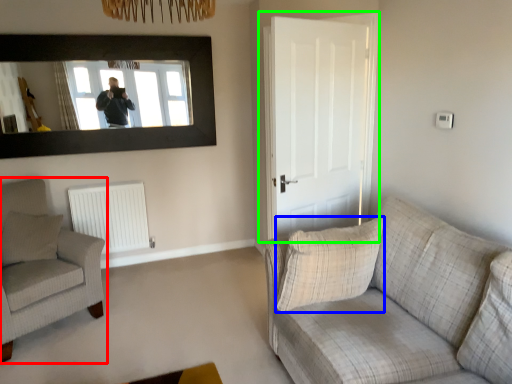
Question: Based on their relative distances, which object is farther from chair (highlighted by a red box)? Choose from pillow (highlighted by a blue box) and door (highlighted by a green box).

Choices:
 (A) pillow
 (B) door

Answer: (B)